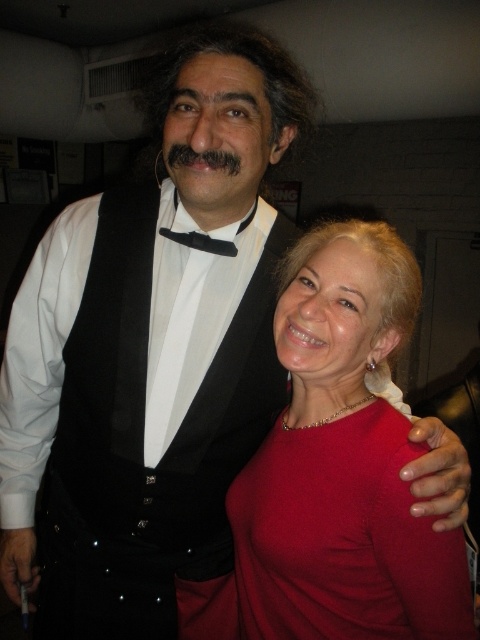
Is black fuzzy mustache at center to the right of black satin bow tie at center from the viewer's perspective?

Correct, you'll find black fuzzy mustache at center to the right of black satin bow tie at center.

Which is in front, point (186, 156) or point (184, 244)?

Point (186, 156) is more forward.

This screenshot has height=640, width=480. In order to click on black fuzzy mustache at center in this screenshot , I will do [x=203, y=157].

Who is shorter, matte red dress at center or black fuzzy mustache at center?

With less height is black fuzzy mustache at center.

Is matte red dress at center above black fuzzy mustache at center?

Actually, matte red dress at center is below black fuzzy mustache at center.

Does point (324, 438) come behind point (171, 156)?

Yes.

Where is `matte red dress at center`? matte red dress at center is located at coordinates (342, 465).

Is matte red dress at center to the right of black satin bow tie at center from the viewer's perspective?

Indeed, matte red dress at center is positioned on the right side of black satin bow tie at center.

Is point (251, 484) closer to viewer compared to point (207, 246)?

That is False.

Which is behind, point (368, 278) or point (158, 228)?

The point (158, 228) is behind.

The image size is (480, 640). What are the coordinates of `matte red dress at center` in the screenshot? It's located at (342, 465).